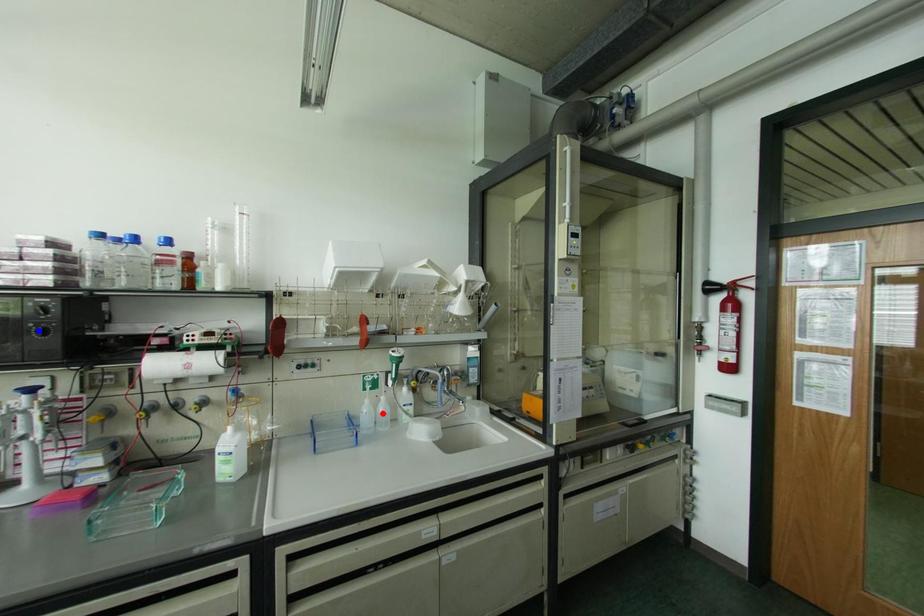
Question: In the image, two points are highlighted. Which point is nearer to the camera? Reply with the corresponding letter.

Choices:
 (A) blue point
 (B) red point

Answer: (A)